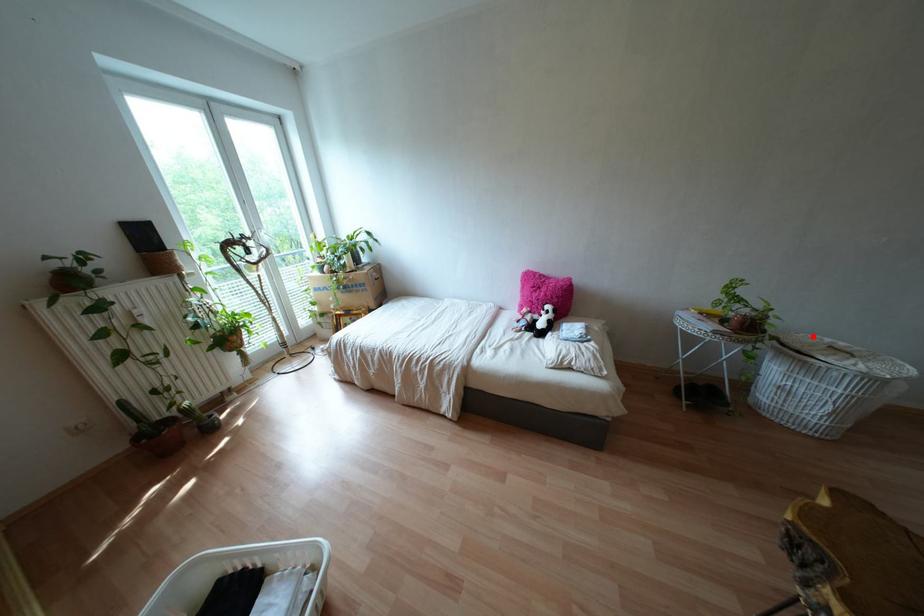
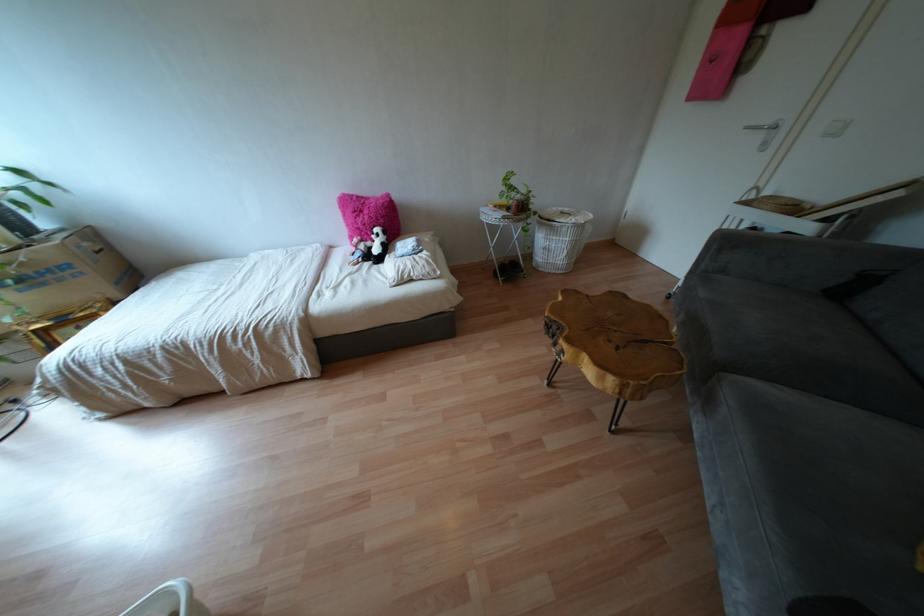
The point at the highlighted location is marked in the first image. Where is the corresponding point in the second image?

(553, 208)